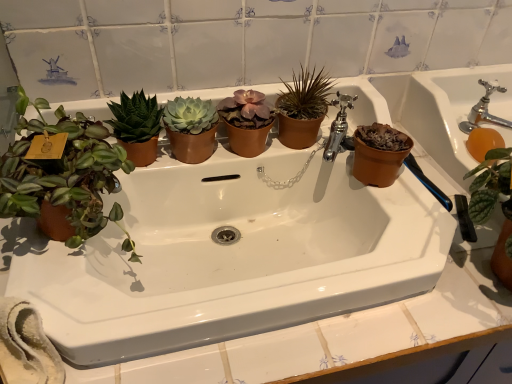
Question: Are white ceramic sink at center and matte brown pot at left, the third houseplant in the right-to-left sequence, located far from each other?

Choices:
 (A) yes
 (B) no

Answer: (B)

Question: Is white ceramic sink at center positioned beyond the bounds of matte brown pot at left, the third houseplant in the right-to-left sequence?

Choices:
 (A) no
 (B) yes

Answer: (B)

Question: Considering the relative sizes of white ceramic sink at center and matte brown pot at left, the third houseplant in the right-to-left sequence, in the image provided, is white ceramic sink at center bigger than matte brown pot at left, the third houseplant in the right-to-left sequence,?

Choices:
 (A) no
 (B) yes

Answer: (B)

Question: Does white ceramic sink at center appear on the right side of matte brown pot at left, the third houseplant in the right-to-left sequence?

Choices:
 (A) yes
 (B) no

Answer: (A)

Question: Does white ceramic sink at center come behind matte brown pot at left, the 1th houseplant from the left?

Choices:
 (A) yes
 (B) no

Answer: (B)

Question: From the image's perspective, does white ceramic sink at center appear higher than matte brown pot at left, the third houseplant in the right-to-left sequence?

Choices:
 (A) yes
 (B) no

Answer: (B)

Question: From the image's perspective, is chrome metallic faucet at upper center, marked as the 1th tap in a left-to-right arrangement, located beneath brown matte pot at center, which appears as the 3th houseplant when viewed from the left?

Choices:
 (A) yes
 (B) no

Answer: (A)

Question: Does chrome metallic faucet at upper center, the 2th tap in the right-to-left sequence, have a lesser width compared to brown matte pot at center, which appears as the 3th houseplant when viewed from the left?

Choices:
 (A) no
 (B) yes

Answer: (A)

Question: From the image's perspective, is chrome metallic faucet at upper center, marked as the 1th tap in a left-to-right arrangement, on brown matte pot at center, which appears as the 3th houseplant when viewed from the left?

Choices:
 (A) yes
 (B) no

Answer: (B)

Question: Does chrome metallic faucet at upper center, the 2th tap in the right-to-left sequence, have a lesser height compared to brown matte pot at center, which appears as the 3th houseplant when viewed from the left?

Choices:
 (A) no
 (B) yes

Answer: (B)

Question: Is chrome metallic faucet at upper center, marked as the 1th tap in a left-to-right arrangement, outside of brown matte pot at center, which appears as the 3th houseplant when viewed from the left?

Choices:
 (A) yes
 (B) no

Answer: (A)

Question: Does chrome metallic faucet at upper center, marked as the 1th tap in a left-to-right arrangement, appear on the left side of brown matte pot at center, marked as the first houseplant in a right-to-left arrangement?

Choices:
 (A) no
 (B) yes

Answer: (A)

Question: Does terracotta pot at right lie in front of white ceramic sink at center?

Choices:
 (A) no
 (B) yes

Answer: (A)